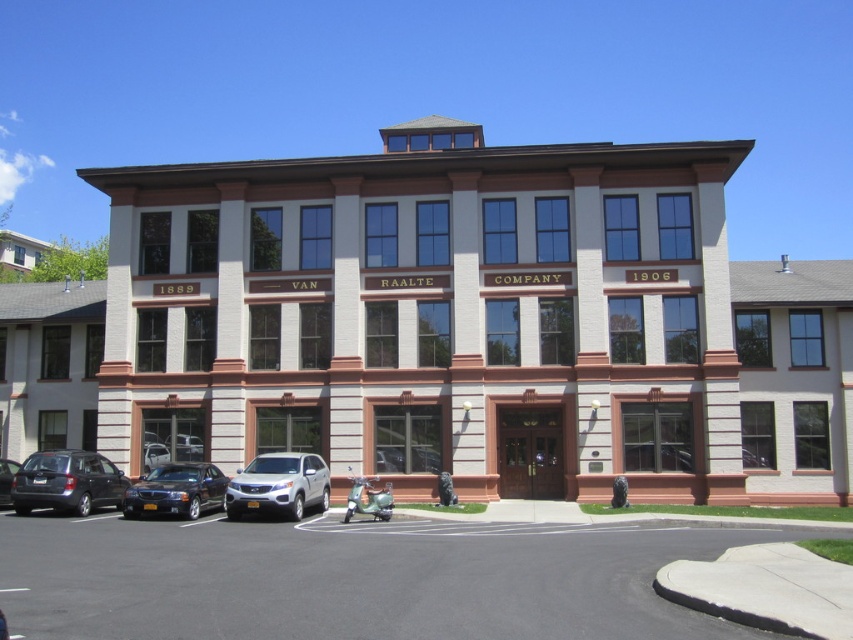
Between point (50, 506) and point (213, 488), which one is positioned in front?

Point (50, 506) is in front.

How far apart are matte gray hatchback at lower left and shiny black sedan at lower left?

matte gray hatchback at lower left and shiny black sedan at lower left are 6.29 feet apart from each other.

Image resolution: width=853 pixels, height=640 pixels. Describe the element at coordinates (67, 483) in the screenshot. I see `matte gray hatchback at lower left` at that location.

At what (x,y) coordinates should I click in order to perform the action: click on matte gray hatchback at lower left. Please return your answer as a coordinate pair (x, y). Looking at the image, I should click on (67, 483).

Can you confirm if satin silver suv at lower center is positioned below matte gray car at lower left?

Yes.

Which is more to the left, satin silver suv at lower center or matte gray car at lower left?

matte gray car at lower left is more to the left.

Is point (310, 504) less distant than point (0, 500)?

Yes, it is in front of point (0, 500).

The image size is (853, 640). What are the coordinates of `satin silver suv at lower center` in the screenshot? It's located at (277, 484).

Is satin silver suv at lower center below shiny black sedan at lower left?

Actually, satin silver suv at lower center is above shiny black sedan at lower left.

Measure the distance between satin silver suv at lower center and camera.

satin silver suv at lower center is 19.61 meters from camera.

This screenshot has height=640, width=853. Find the location of `satin silver suv at lower center`. satin silver suv at lower center is located at coordinates (277, 484).